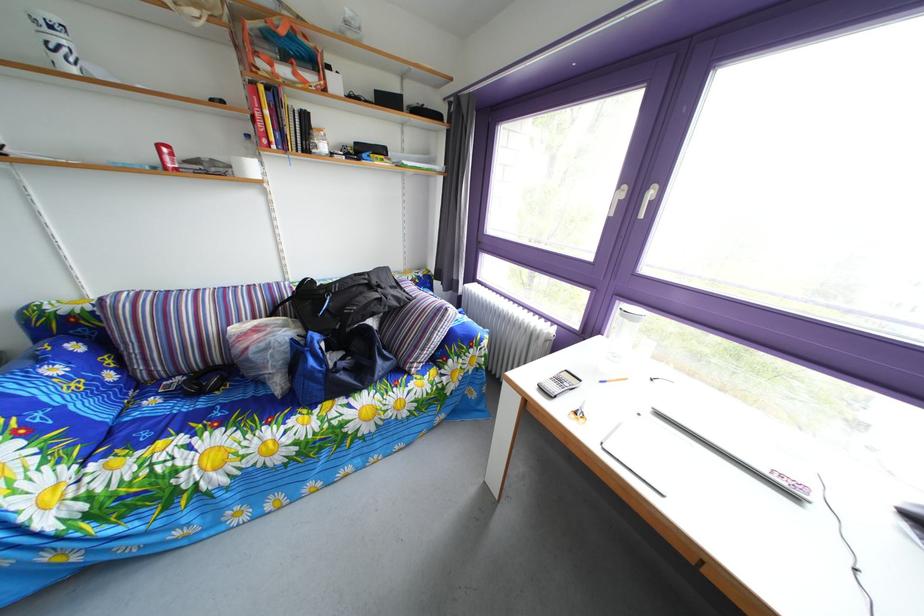
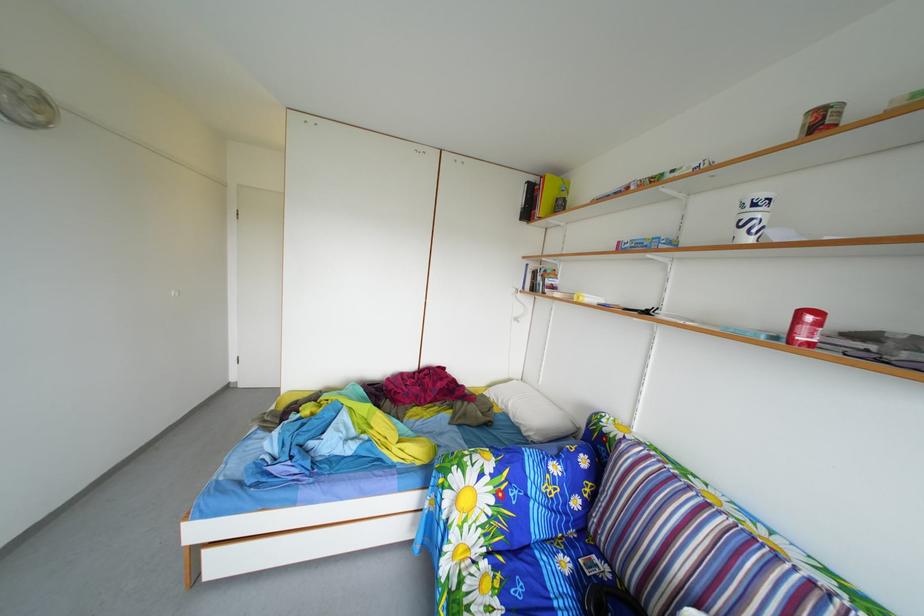
Where in the second image is the point corresponding to [62,36] from the first image?

(766, 214)